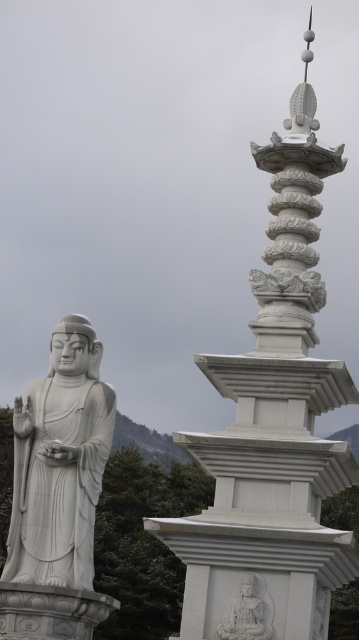
Question: Which point is closer to the camera?

Choices:
 (A) white marble statue at left
 (B) white stone statue at center

Answer: (B)

Question: Can you confirm if white stone pagoda at upper center is positioned to the right of white stone statue at center?

Choices:
 (A) no
 (B) yes

Answer: (B)

Question: Considering the real-world distances, which object is closest to the white stone pagoda at upper center?

Choices:
 (A) white marble statue at left
 (B) white stone statue at center

Answer: (B)

Question: Which point is farther to the camera?

Choices:
 (A) white marble statue at left
 (B) white stone statue at center

Answer: (A)

Question: From the image, what is the correct spatial relationship of white marble statue at left in relation to white stone statue at center?

Choices:
 (A) below
 (B) above

Answer: (B)

Question: Is white marble statue at left smaller than white stone statue at center?

Choices:
 (A) yes
 (B) no

Answer: (B)